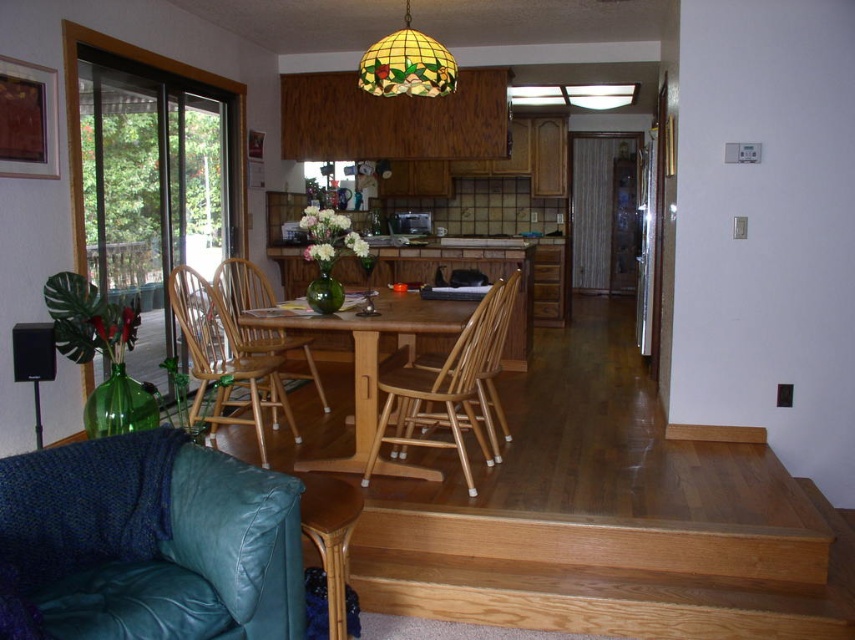
Which is above, wooden table at center or beech wood armchair at center?

beech wood armchair at center

Is wooden table at center smaller than beech wood armchair at center?

Indeed, wooden table at center has a smaller size compared to beech wood armchair at center.

Does point (358, 356) lie behind point (227, 266)?

No, it is not.

Where is `wooden table at center`? wooden table at center is located at coordinates (370, 355).

Which is behind, point (376, 456) or point (245, 268)?

The point (245, 268) is behind.

The width and height of the screenshot is (855, 640). What do you see at coordinates (439, 394) in the screenshot? I see `wooden chair at center` at bounding box center [439, 394].

Locate an element on the screen. wooden chair at center is located at coordinates (439, 394).

Which is more to the left, wooden table at center or stained glass lampshade at upper center?

wooden table at center

Can you confirm if wooden table at center is positioned to the right of stained glass lampshade at upper center?

Incorrect, wooden table at center is not on the right side of stained glass lampshade at upper center.

What are the coordinates of `wooden table at center` in the screenshot? It's located at (370, 355).